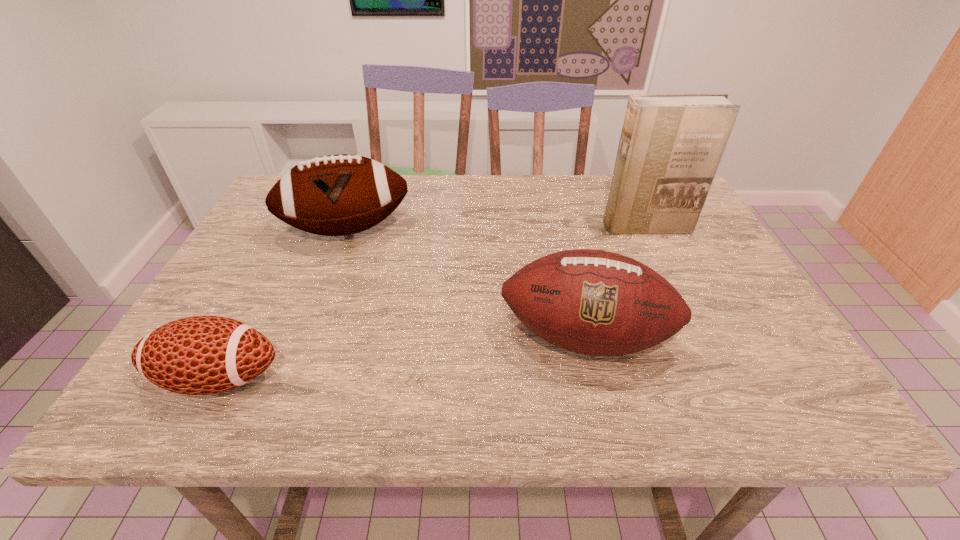
The image size is (960, 540). Find the location of `object located in the far left corner section of the desktop`. object located in the far left corner section of the desktop is located at coordinates (336, 195).

The height and width of the screenshot is (540, 960). I want to click on object that is at the near left corner, so click(x=200, y=355).

This screenshot has width=960, height=540. Find the location of `vacant space at the far edge of the desktop`. vacant space at the far edge of the desktop is located at coordinates [x=492, y=185].

Locate an element on the screen. blank space at the near edge is located at coordinates (272, 390).

The height and width of the screenshot is (540, 960). I want to click on vacant space at the right edge, so click(x=728, y=333).

Where is `blank area at the near left corner`? blank area at the near left corner is located at coordinates (212, 410).

The height and width of the screenshot is (540, 960). I want to click on free spot at the near right corner of the desktop, so click(804, 390).

Find the location of `vacant space in between the farthest football and the phonebook`. vacant space in between the farthest football and the phonebook is located at coordinates (496, 228).

You are a GUI agent. You are given a task and a screenshot of the screen. Output one action in this format:
    pyautogui.click(x=<x>, y=<y>)
    Task: Click on the vacant area between the tallest object and the shortest football
    This screenshot has width=960, height=540.
    Given the screenshot: What is the action you would take?
    tap(432, 302)

The width and height of the screenshot is (960, 540). Identify the location of free space between the shortest football and the farthest football. (283, 304).